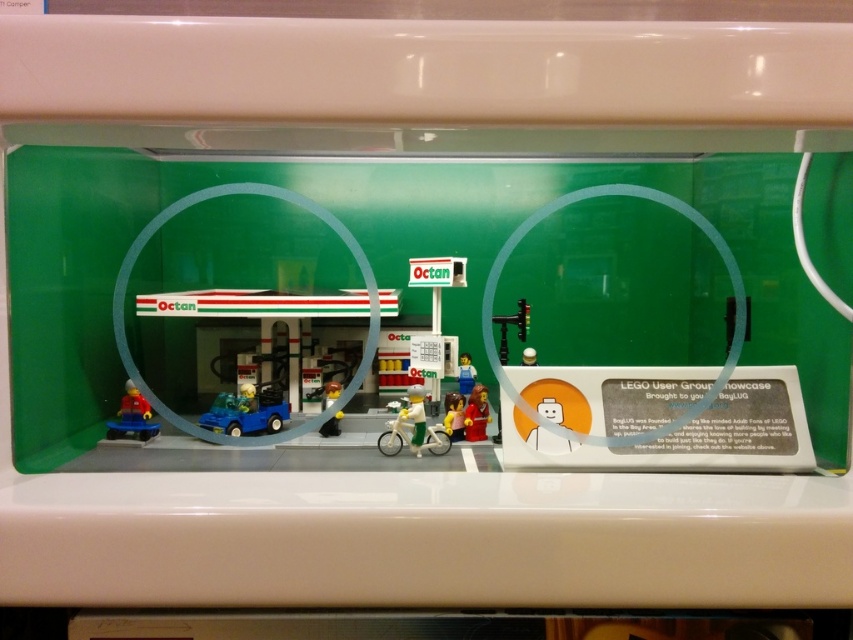
Who is higher up, blue plastic car at center or smooth red figure at center?

blue plastic car at center

I want to click on blue plastic car at center, so 247,412.

Consider the image. Who is more distant from viewer, (258, 400) or (483, 419)?

The point (258, 400) is more distant.

I want to click on blue plastic car at center, so click(x=247, y=412).

Measure the distance between smooth red figure at center and smooth plastic bicycle at center.

smooth red figure at center is 0.43 inches from smooth plastic bicycle at center.

Between smooth red figure at center and smooth plastic bicycle at center, which one appears on the left side from the viewer's perspective?

From the viewer's perspective, smooth plastic bicycle at center appears more on the left side.

Is point (479, 396) positioned in front of point (456, 416)?

No, it is not.

You are a GUI agent. You are given a task and a screenshot of the screen. Output one action in this format:
    pyautogui.click(x=<x>, y=<y>)
    Task: Click on the smooth red figure at center
    Image resolution: width=853 pixels, height=640 pixels.
    Given the screenshot: What is the action you would take?
    pyautogui.click(x=476, y=413)

Who is higher up, white glossy counter top at lower center or blue plastic car at center?

blue plastic car at center is above.

Locate an element on the screen. This screenshot has width=853, height=640. white glossy counter top at lower center is located at coordinates (424, 540).

Where is `white glossy counter top at lower center`? Image resolution: width=853 pixels, height=640 pixels. white glossy counter top at lower center is located at coordinates (424, 540).